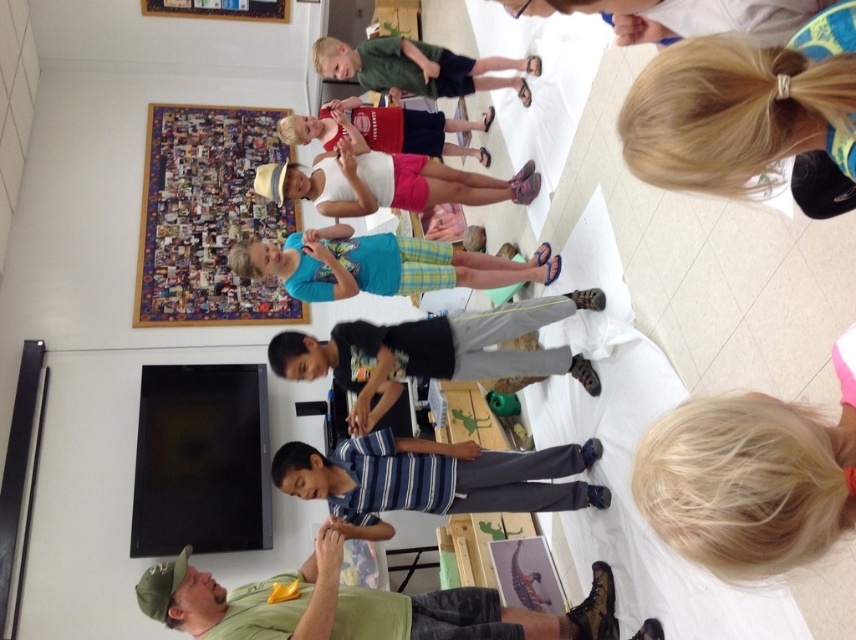
Question: Does blonde hair at lower right have a lesser width compared to white matte tank top at center?

Choices:
 (A) yes
 (B) no

Answer: (A)

Question: Can you confirm if blue striped shirt at center is thinner than black cotton shirt at center?

Choices:
 (A) no
 (B) yes

Answer: (A)

Question: Can you confirm if black cotton shirt at center is bigger than matte red shirt at center?

Choices:
 (A) yes
 (B) no

Answer: (B)

Question: Which object is closer to the camera taking this photo?

Choices:
 (A) blonde hair at lower right
 (B) matte red shirt at center
 (C) green matte shirt at upper center

Answer: (A)

Question: Among these objects, which one is nearest to the camera?

Choices:
 (A) blonde hair at lower right
 (B) white matte tank top at center

Answer: (A)

Question: Estimate the real-world distances between objects in this image. Which object is closer to the matte red shirt at center?

Choices:
 (A) white matte tank top at center
 (B) green matte shirt at upper center

Answer: (B)